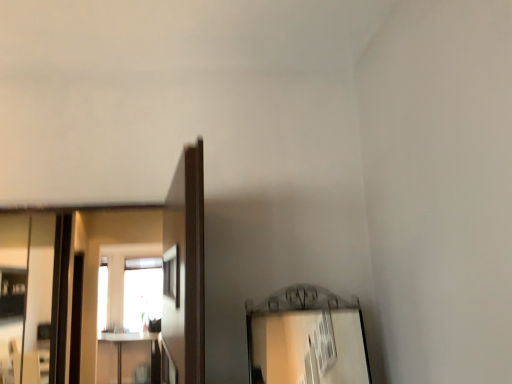
I want to click on silver metallic mirror at left, which is counted as the first mirror, starting from the right, so click(x=13, y=293).

Image resolution: width=512 pixels, height=384 pixels. What do you see at coordinates (13, 293) in the screenshot?
I see `silver metallic mirror at left, the second mirror from the back` at bounding box center [13, 293].

What is the approximate width of clear glass mirror at left, acting as the second mirror starting from the right?

clear glass mirror at left, acting as the second mirror starting from the right, is 0.52 inches wide.

This screenshot has height=384, width=512. Describe the element at coordinates (34, 295) in the screenshot. I see `clear glass mirror at left, the 1th mirror positioned from the back` at that location.

You are a GUI agent. You are given a task and a screenshot of the screen. Output one action in this format:
    pyautogui.click(x=<x>, y=<y>)
    Task: Click on the clear glass mirror at left, which appears as the first mirror when viewed from the left
    The width and height of the screenshot is (512, 384).
    Given the screenshot: What is the action you would take?
    pyautogui.click(x=34, y=295)

At what (x,y) coordinates should I click in order to perform the action: click on silver metallic mirror at left, which is the first mirror in front-to-back order. Please return your answer as a coordinate pair (x, y). This screenshot has height=384, width=512. Looking at the image, I should click on (13, 293).

Based on their positions, is silver metallic mirror at left, which is counted as the 2th mirror, starting from the left, located to the left or right of clear glass mirror at left, which is the 2th mirror from front to back?

From the image, it's evident that silver metallic mirror at left, which is counted as the 2th mirror, starting from the left, is to the right of clear glass mirror at left, which is the 2th mirror from front to back.

Relative to clear glass mirror at left, acting as the second mirror starting from the right, is silver metallic mirror at left, which is the first mirror in front-to-back order, in front or behind?

silver metallic mirror at left, which is the first mirror in front-to-back order, is in front of clear glass mirror at left, acting as the second mirror starting from the right.

Is point (27, 225) farther from viewer compared to point (10, 237)?

Yes, it is.

From the image's perspective, which one is positioned higher, silver metallic mirror at left, the second mirror from the back, or clear glass mirror at left, acting as the second mirror starting from the right?

silver metallic mirror at left, the second mirror from the back, from the image's perspective.

From a real-world perspective, is silver metallic mirror at left, the second mirror from the back, positioned above or below clear glass mirror at left, the 1th mirror positioned from the back?

In terms of real-world spatial position, silver metallic mirror at left, the second mirror from the back, is above clear glass mirror at left, the 1th mirror positioned from the back.

In the scene shown: Considering the relative sizes of silver metallic mirror at left, which is the first mirror in front-to-back order, and clear glass mirror at left, the 1th mirror positioned from the back, in the image provided, is silver metallic mirror at left, which is the first mirror in front-to-back order, thinner than clear glass mirror at left, the 1th mirror positioned from the back,?

Yes.

Which of these two, silver metallic mirror at left, which is counted as the first mirror, starting from the right, or clear glass mirror at left, which is the 2th mirror from front to back, stands taller?

clear glass mirror at left, which is the 2th mirror from front to back.

Consider the image. Who is smaller, silver metallic mirror at left, which is counted as the first mirror, starting from the right, or clear glass mirror at left, which appears as the first mirror when viewed from the left?

With smaller size is silver metallic mirror at left, which is counted as the first mirror, starting from the right.

Is silver metallic mirror at left, which is the first mirror in front-to-back order, inside or outside of clear glass mirror at left, which is the 2th mirror from front to back?

silver metallic mirror at left, which is the first mirror in front-to-back order, is located beyond the bounds of clear glass mirror at left, which is the 2th mirror from front to back.

Is silver metallic mirror at left, which is counted as the 2th mirror, starting from the left, not close to clear glass mirror at left, the 1th mirror positioned from the back?

No, silver metallic mirror at left, which is counted as the 2th mirror, starting from the left, is not far from clear glass mirror at left, the 1th mirror positioned from the back.

Is clear glass mirror at left, which is the 2th mirror from front to back, at the back of silver metallic mirror at left, which is counted as the first mirror, starting from the right?

No, silver metallic mirror at left, which is counted as the first mirror, starting from the right, is not facing away from clear glass mirror at left, which is the 2th mirror from front to back.

Could you measure the distance between silver metallic mirror at left, the second mirror from the back, and clear glass mirror at left, which is the 2th mirror from front to back?

A distance of 7.74 inches exists between silver metallic mirror at left, the second mirror from the back, and clear glass mirror at left, which is the 2th mirror from front to back.

In the image, there is a clear glass mirror at left, the 1th mirror positioned from the back. At what (x,y) coordinates should I click in order to perform the action: click on mirror above it (from the image's perspective). Please return your answer as a coordinate pair (x, y). This screenshot has width=512, height=384. Looking at the image, I should click on (13, 293).

Considering the relative positions of clear glass mirror at left, which appears as the first mirror when viewed from the left, and silver metallic mirror at left, which is counted as the first mirror, starting from the right, in the image provided, is clear glass mirror at left, which appears as the first mirror when viewed from the left, to the left or to the right of silver metallic mirror at left, which is counted as the first mirror, starting from the right,?

clear glass mirror at left, which appears as the first mirror when viewed from the left, is to the left of silver metallic mirror at left, which is counted as the first mirror, starting from the right.

Is clear glass mirror at left, acting as the second mirror starting from the right, further to the viewer compared to silver metallic mirror at left, which is counted as the 2th mirror, starting from the left?

Yes, clear glass mirror at left, acting as the second mirror starting from the right, is further from the viewer.

Considering the points (15, 270) and (11, 271), which point is in front, point (15, 270) or point (11, 271)?

The point (11, 271) is more forward.

From the image's perspective, who appears lower, clear glass mirror at left, which appears as the first mirror when viewed from the left, or silver metallic mirror at left, which is counted as the 2th mirror, starting from the left?

clear glass mirror at left, which appears as the first mirror when viewed from the left, from the image's perspective.

From a real-world perspective, which is physically above, clear glass mirror at left, which appears as the first mirror when viewed from the left, or silver metallic mirror at left, which is counted as the first mirror, starting from the right?

In real-world perspective, silver metallic mirror at left, which is counted as the first mirror, starting from the right, is above.

Considering the sizes of objects clear glass mirror at left, which is the 2th mirror from front to back, and silver metallic mirror at left, the second mirror from the back, in the image provided, who is thinner, clear glass mirror at left, which is the 2th mirror from front to back, or silver metallic mirror at left, the second mirror from the back,?

Thinner between the two is silver metallic mirror at left, the second mirror from the back.

Considering the sizes of objects clear glass mirror at left, which is the 2th mirror from front to back, and silver metallic mirror at left, which is the first mirror in front-to-back order, in the image provided, who is taller, clear glass mirror at left, which is the 2th mirror from front to back, or silver metallic mirror at left, which is the first mirror in front-to-back order,?

With more height is clear glass mirror at left, which is the 2th mirror from front to back.

Who is bigger, clear glass mirror at left, which appears as the first mirror when viewed from the left, or silver metallic mirror at left, which is the first mirror in front-to-back order?

clear glass mirror at left, which appears as the first mirror when viewed from the left.

Is clear glass mirror at left, the 1th mirror positioned from the back, outside of silver metallic mirror at left, the second mirror from the back?

Indeed, clear glass mirror at left, the 1th mirror positioned from the back, is completely outside silver metallic mirror at left, the second mirror from the back.

Is clear glass mirror at left, the 1th mirror positioned from the back, in contact with silver metallic mirror at left, which is the first mirror in front-to-back order?

No, clear glass mirror at left, the 1th mirror positioned from the back, is not making contact with silver metallic mirror at left, which is the first mirror in front-to-back order.

Is clear glass mirror at left, which is the 2th mirror from front to back, facing towards silver metallic mirror at left, which is counted as the 2th mirror, starting from the left?

No, clear glass mirror at left, which is the 2th mirror from front to back, is not turned towards silver metallic mirror at left, which is counted as the 2th mirror, starting from the left.

How different are the orientations of clear glass mirror at left, the 1th mirror positioned from the back, and silver metallic mirror at left, which is the first mirror in front-to-back order, in degrees?

The facing directions of clear glass mirror at left, the 1th mirror positioned from the back, and silver metallic mirror at left, which is the first mirror in front-to-back order, are 0.00209 degrees apart.

You are a GUI agent. You are given a task and a screenshot of the screen. Output one action in this format:
    pyautogui.click(x=<x>, y=<y>)
    Task: Click on the mirror above the clear glass mirror at left, the 1th mirror positioned from the back (from a real-world perspective)
    The width and height of the screenshot is (512, 384).
    Given the screenshot: What is the action you would take?
    pyautogui.click(x=13, y=293)

Where is `mirror on the left of silver metallic mirror at left, which is counted as the 2th mirror, starting from the left`? The image size is (512, 384). mirror on the left of silver metallic mirror at left, which is counted as the 2th mirror, starting from the left is located at coordinates (34, 295).

The height and width of the screenshot is (384, 512). Identify the location of mirror lying on the right of clear glass mirror at left, which appears as the first mirror when viewed from the left. (13, 293).